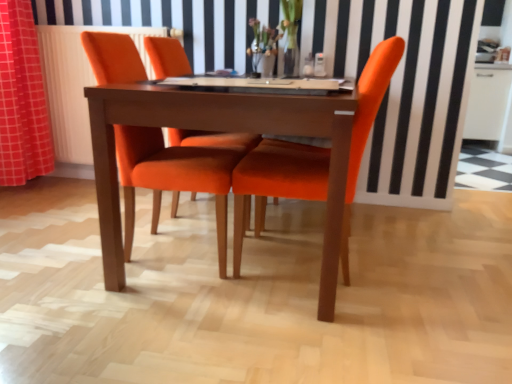
Question: Is orange fabric chair at center, positioned as the 1th chair in left-to-right order, oriented towards orange fabric curtain at left?

Choices:
 (A) no
 (B) yes

Answer: (A)

Question: From a real-world perspective, is orange fabric chair at center, the 2th chair when ordered from right to left, positioned under orange fabric curtain at left based on gravity?

Choices:
 (A) no
 (B) yes

Answer: (B)

Question: Is orange fabric chair at center, the 2th chair when ordered from right to left, at the right side of orange fabric curtain at left?

Choices:
 (A) no
 (B) yes

Answer: (B)

Question: Is orange fabric curtain at left surrounded by orange fabric chair at center, the 2th chair when ordered from right to left?

Choices:
 (A) yes
 (B) no

Answer: (B)

Question: Considering the relative sizes of orange fabric chair at center, the 2th chair when ordered from right to left, and orange fabric curtain at left in the image provided, is orange fabric chair at center, the 2th chair when ordered from right to left, bigger than orange fabric curtain at left?

Choices:
 (A) yes
 (B) no

Answer: (A)

Question: From a real-world perspective, relative to wooden table at center, is white radiator at left vertically above or below?

Choices:
 (A) below
 (B) above

Answer: (B)

Question: Relative to wooden table at center, is white radiator at left in front or behind?

Choices:
 (A) front
 (B) behind

Answer: (B)

Question: Is white radiator at left inside the boundaries of wooden table at center, or outside?

Choices:
 (A) outside
 (B) inside

Answer: (A)

Question: Would you say white radiator at left is to the left or to the right of wooden table at center in the picture?

Choices:
 (A) right
 (B) left

Answer: (B)

Question: Is orange fabric chair at center, the 2th chair when ordered from right to left, wider or thinner than orange fabric curtain at left?

Choices:
 (A) thin
 (B) wide

Answer: (B)

Question: Based on their sizes in the image, would you say orange fabric chair at center, positioned as the 1th chair in left-to-right order, is bigger or smaller than orange fabric curtain at left?

Choices:
 (A) small
 (B) big

Answer: (B)

Question: From a real-world perspective, is orange fabric chair at center, positioned as the 1th chair in left-to-right order, physically located above or below orange fabric curtain at left?

Choices:
 (A) above
 (B) below

Answer: (B)

Question: Relative to orange fabric curtain at left, is orange fabric chair at center, positioned as the 1th chair in left-to-right order, in front or behind?

Choices:
 (A) front
 (B) behind

Answer: (A)

Question: Is orange fabric curtain at left wider or thinner than orange fabric chair at center, positioned as the 1th chair in left-to-right order?

Choices:
 (A) thin
 (B) wide

Answer: (A)

Question: From the image's perspective, is orange fabric curtain at left above or below orange fabric chair at center, the 2th chair when ordered from right to left?

Choices:
 (A) above
 (B) below

Answer: (A)